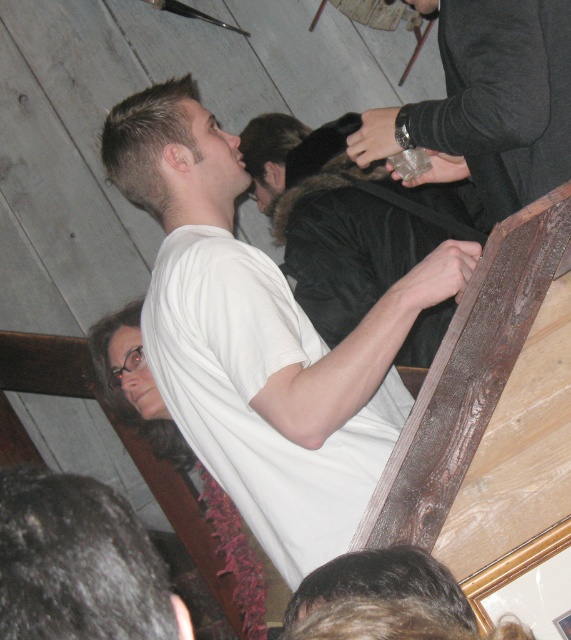
Between dark curly hair at lower left and dark brown fur at upper center, which one appears on the right side from the viewer's perspective?

dark brown fur at upper center

Is dark curly hair at lower left positioned before dark brown fur at upper center?

That is True.

Is point (90, 513) farther from viewer compared to point (292, 140)?

No, it is not.

This screenshot has height=640, width=571. In order to click on dark curly hair at lower left in this screenshot , I will do `click(78, 563)`.

Which is below, translucent glass cup at upper right or dark brown hair at lower center?

dark brown hair at lower center is lower down.

Between translucent glass cup at upper right and dark brown hair at lower center, which one has less height?

Standing shorter between the two is dark brown hair at lower center.

Does point (460, 1) lie behind point (363, 556)?

Yes, point (460, 1) is farther from viewer.

Locate an element on the screen. translucent glass cup at upper right is located at coordinates point(492,100).

Between point (500, 134) and point (159, 458), which one is positioned behind?

Positioned behind is point (159, 458).

Is point (526, 163) less distant than point (190, 456)?

Yes.

Identify the location of translucent glass cup at upper right. This screenshot has height=640, width=571. (492, 100).

I want to click on translucent glass cup at upper right, so click(492, 100).